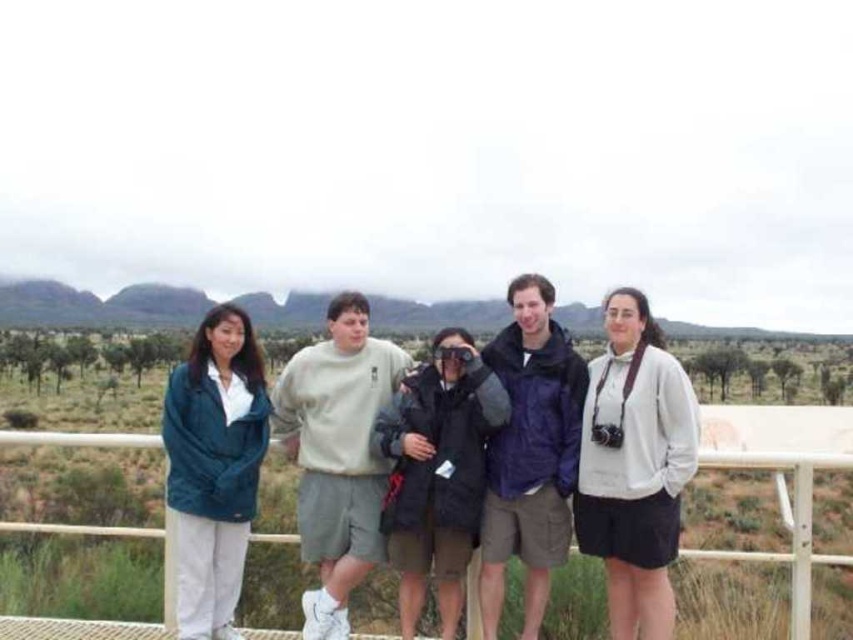
Question: Estimate the real-world distances between objects in this image. Which object is farther from the teal fleece jacket at left?

Choices:
 (A) metallic white fence at center
 (B) white matte jacket at center

Answer: (A)

Question: Which of the following is the closest to the observer?

Choices:
 (A) (604, 536)
 (B) (196, 403)

Answer: (A)

Question: Estimate the real-world distances between objects in this image. Which object is closer to the white matte jacket at center?

Choices:
 (A) metallic white fence at center
 (B) teal fleece jacket at left

Answer: (B)

Question: Considering the relative positions of teal fleece jacket at left and metallic white fence at center in the image provided, where is teal fleece jacket at left located with respect to metallic white fence at center?

Choices:
 (A) below
 (B) above

Answer: (B)

Question: Does white matte jacket at center have a larger size compared to teal fleece jacket at left?

Choices:
 (A) yes
 (B) no

Answer: (A)

Question: Does teal fleece jacket at left appear over metallic white fence at center?

Choices:
 (A) no
 (B) yes

Answer: (B)